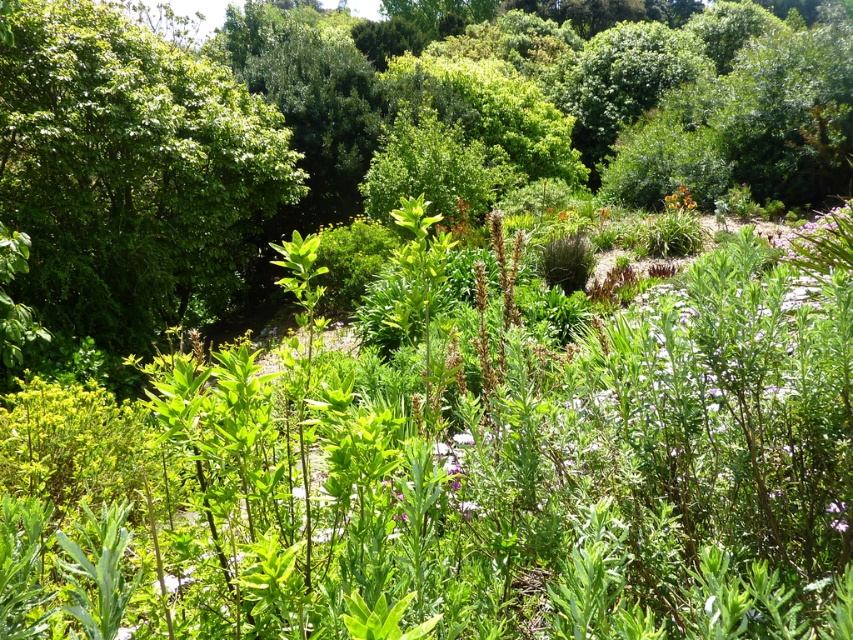
Between green leafy tree at center and purple matte flower at upper right, which one appears on the right side from the viewer's perspective?

purple matte flower at upper right is more to the right.

Can you confirm if green leafy tree at center is thinner than purple matte flower at upper right?

No.

You are a GUI agent. You are given a task and a screenshot of the screen. Output one action in this format:
    pyautogui.click(x=<x>, y=<y>)
    Task: Click on the green leafy tree at center
    
    Given the screenshot: What is the action you would take?
    pyautogui.click(x=376, y=140)

Which is in front, point (112, 60) or point (691, 202)?

Point (112, 60)

Looking at this image, is green leafy tree at upper left positioned behind orange matte flower at upper right?

No, green leafy tree at upper left is closer to the viewer.

Locate an element on the screen. This screenshot has width=853, height=640. green leafy tree at upper left is located at coordinates (131, 173).

Does point (222, 161) come in front of point (672, 192)?

Yes, it is in front of point (672, 192).

Who is higher up, green leafy tree at center or orange matte flower at upper right?

green leafy tree at center

Find the location of `green leafy tree at center`. green leafy tree at center is located at coordinates (376, 140).